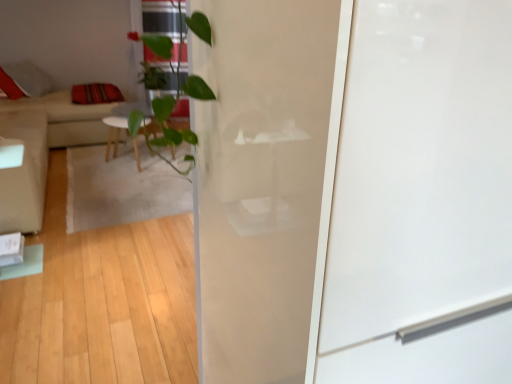
This screenshot has width=512, height=384. Find the location of `transparent glass screen door at center`. transparent glass screen door at center is located at coordinates (422, 199).

This screenshot has height=384, width=512. Find the location of `beige fabric armchair at left`. beige fabric armchair at left is located at coordinates (22, 170).

Identify the location of transparent glass screen door at center. This screenshot has height=384, width=512. (422, 199).

Looking at this image, do you think beige fabric armchair at left is within beige fabric couch at left, or outside of it?

beige fabric armchair at left is outside beige fabric couch at left.

From a real-world perspective, which is physically above, beige fabric armchair at left or beige fabric couch at left?

From a 3D spatial view, beige fabric couch at left is above.

In terms of height, does beige fabric armchair at left look taller or shorter compared to beige fabric couch at left?

beige fabric armchair at left is taller than beige fabric couch at left.

In the scene shown: Is beige fabric couch at left far away from transparent glass screen door at center?

Yes, beige fabric couch at left is far from transparent glass screen door at center.

Who is bigger, beige fabric couch at left or transparent glass screen door at center?

transparent glass screen door at center is bigger.

Looking at this image, how different are the orientations of beige fabric couch at left and transparent glass screen door at center in degrees?

The angle between the facing direction of beige fabric couch at left and the facing direction of transparent glass screen door at center is 90.5 degrees.

Which object is wider, beige fabric couch at left or transparent glass screen door at center?

Wider between the two is beige fabric couch at left.

From the image's perspective, is transparent glass screen door at center below striped fabric pillow at left?

Correct, transparent glass screen door at center appears lower than striped fabric pillow at left in the image.

Is transparent glass screen door at center aimed at striped fabric pillow at left?

No, transparent glass screen door at center does not turn towards striped fabric pillow at left.

Can you tell me how much transparent glass screen door at center and striped fabric pillow at left differ in facing direction?

transparent glass screen door at center and striped fabric pillow at left are facing 90.5 degrees away from each other.

Is transparent glass screen door at center positioned far away from striped fabric pillow at left?

transparent glass screen door at center is positioned a significant distance from striped fabric pillow at left.

How different are the orientations of transparent glass screen door at center and beige fabric armchair at left in degrees?

The angular difference between transparent glass screen door at center and beige fabric armchair at left is 90.5 degrees.

From the image's perspective, which is below, transparent glass screen door at center or beige fabric armchair at left?

transparent glass screen door at center is shown below in the image.

Considering the positions of point (325, 269) and point (41, 223), is point (325, 269) closer or farther from the camera than point (41, 223)?

Point (325, 269) is positioned closer to the camera compared to point (41, 223).

Who is taller, transparent glass screen door at center or beige fabric armchair at left?

transparent glass screen door at center is taller.

Between striped fabric pillow at left and transparent glass screen door at center, which one has larger size?

transparent glass screen door at center is bigger.

Is striped fabric pillow at left spatially inside transparent glass screen door at center, or outside of it?

striped fabric pillow at left is outside transparent glass screen door at center.

From a real-world perspective, is striped fabric pillow at left positioned over transparent glass screen door at center based on gravity?

No, from a real-world perspective, striped fabric pillow at left is not over transparent glass screen door at center

Who is taller, striped fabric pillow at left or transparent glass screen door at center?

transparent glass screen door at center.

From a real-world perspective, is beige fabric couch at left positioned above or below striped fabric pillow at left?

In terms of real-world spatial position, beige fabric couch at left is below striped fabric pillow at left.

From the image's perspective, which object appears higher, beige fabric couch at left or striped fabric pillow at left?

striped fabric pillow at left.

Considering the relative sizes of beige fabric couch at left and striped fabric pillow at left in the image provided, is beige fabric couch at left smaller than striped fabric pillow at left?

No.

Identify the location of couch located underneath the striped fabric pillow at left (from a real-world perspective). The image size is (512, 384). (66, 118).

Would you say beige fabric couch at left contains beige fabric armchair at left?

No, beige fabric couch at left does not contain beige fabric armchair at left.

Find the location of a particular element. Image resolution: width=512 pixels, height=384 pixels. armchair below the beige fabric couch at left (from the image's perspective) is located at coordinates (22, 170).

Is beige fabric couch at left wider or thinner than beige fabric armchair at left?

beige fabric couch at left is wider than beige fabric armchair at left.

Image resolution: width=512 pixels, height=384 pixels. What are the coordinates of `armchair below the beige fabric couch at left (from the image's perspective)` in the screenshot? It's located at pyautogui.click(x=22, y=170).

The width and height of the screenshot is (512, 384). What are the coordinates of `couch located underneath the transparent glass screen door at center (from a real-world perspective)` in the screenshot? It's located at click(66, 118).

From the image, which object appears to be nearer to beige fabric couch at left, striped fabric pillow at left or beige fabric armchair at left?

Based on the image, striped fabric pillow at left appears to be nearer to beige fabric couch at left.

When comparing their distances from striped fabric pillow at left, does transparent glass screen door at center or beige fabric couch at left seem closer?

beige fabric couch at left is positioned closer to the anchor striped fabric pillow at left.

Based on their spatial positions, is transparent glass screen door at center or beige fabric couch at left closer to beige fabric armchair at left?

Based on the image, beige fabric couch at left appears to be nearer to beige fabric armchair at left.

From the image, which object appears to be nearer to beige fabric armchair at left, striped fabric pillow at left or beige fabric couch at left?

beige fabric couch at left is closer to beige fabric armchair at left.

Based on their spatial positions, is beige fabric armchair at left or striped fabric pillow at left closer to beige fabric couch at left?

The object closer to beige fabric couch at left is striped fabric pillow at left.

In the scene shown: Which object lies further to the anchor point beige fabric couch at left, beige fabric armchair at left or transparent glass screen door at center?

transparent glass screen door at center is further to beige fabric couch at left.

Considering their positions, is striped fabric pillow at left positioned closer to transparent glass screen door at center than beige fabric armchair at left?

Based on the image, beige fabric armchair at left appears to be nearer to transparent glass screen door at center.

Based on their spatial positions, is beige fabric armchair at left or striped fabric pillow at left further from transparent glass screen door at center?

Based on the image, striped fabric pillow at left appears to be further to transparent glass screen door at center.

At what (x,y) coordinates should I click in order to perform the action: click on armchair positioned between transparent glass screen door at center and striped fabric pillow at left from near to far. Please return your answer as a coordinate pair (x, y). Looking at the image, I should click on (22, 170).

This screenshot has height=384, width=512. Identify the location of couch positioned between transparent glass screen door at center and striped fabric pillow at left from near to far. (66, 118).

Image resolution: width=512 pixels, height=384 pixels. I want to click on armchair between transparent glass screen door at center and beige fabric couch at left along the z-axis, so click(x=22, y=170).

The height and width of the screenshot is (384, 512). Identify the location of couch located between beige fabric armchair at left and striped fabric pillow at left in the depth direction. 66,118.